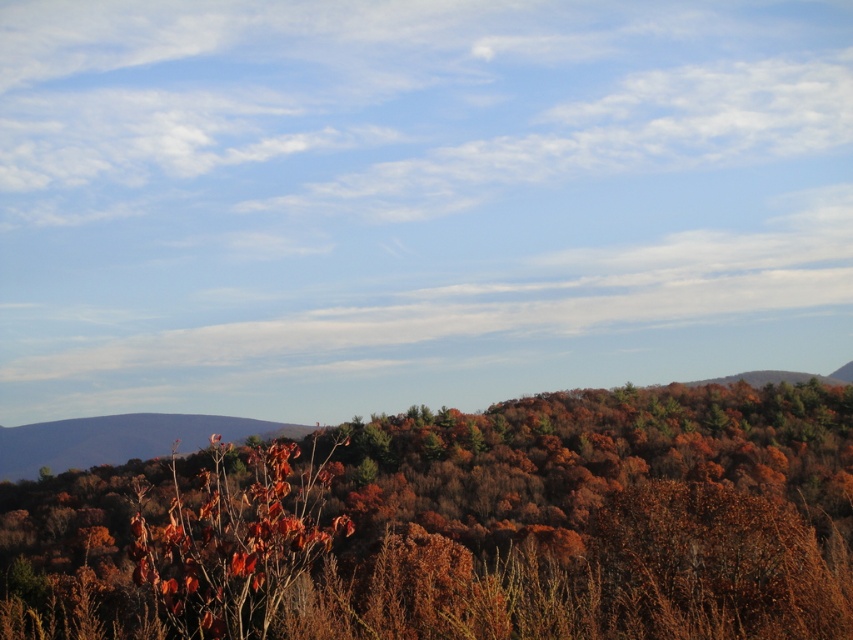
Question: Among these points, which one is nearest to the camera?

Choices:
 (A) (396, 541)
 (B) (177, 528)

Answer: (B)

Question: Which point is farther to the camera?

Choices:
 (A) brown matte tree at center
 (B) leathery brown leaves at center

Answer: (B)

Question: Is brown matte tree at center to the left of leathery brown leaves at center from the viewer's perspective?

Choices:
 (A) no
 (B) yes

Answer: (A)

Question: Does brown matte tree at center have a smaller size compared to leathery brown leaves at center?

Choices:
 (A) yes
 (B) no

Answer: (B)

Question: Can you confirm if brown matte tree at center is bigger than leathery brown leaves at center?

Choices:
 (A) no
 (B) yes

Answer: (B)